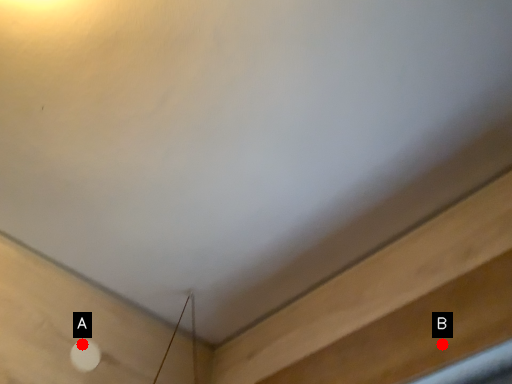
Question: Two points are circled on the image, labeled by A and B beside each circle. Which of the following is the closest to the observer?

Choices:
 (A) A is closer
 (B) B is closer

Answer: (B)